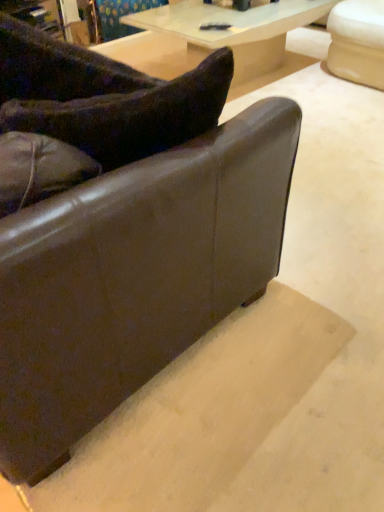
Question: Relative to brown leather couch at lower left, is translucent glass table at upper center in front or behind?

Choices:
 (A) front
 (B) behind

Answer: (B)

Question: From the image's perspective, is translucent glass table at upper center located above or below brown leather couch at lower left?

Choices:
 (A) above
 (B) below

Answer: (A)

Question: Estimate the real-world distances between objects in this image. Which object is closer to the velvety dark brown pillow at upper left?

Choices:
 (A) brown leather couch at lower left
 (B) translucent glass table at upper center

Answer: (A)

Question: Which object is positioned farthest from the velvety dark brown pillow at upper left?

Choices:
 (A) translucent glass table at upper center
 (B) brown leather couch at lower left

Answer: (A)